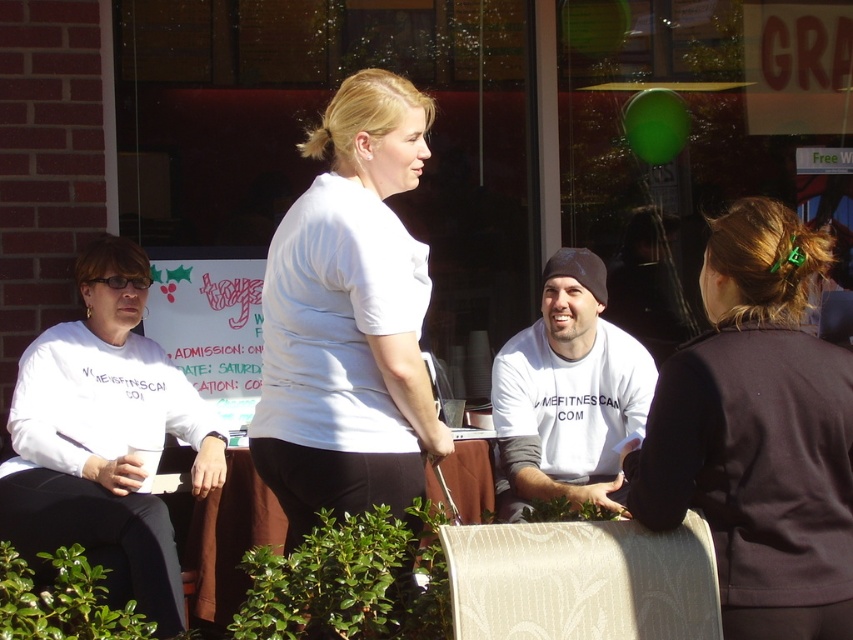
Between white matte shirt at center and white matte shirt at left, which one is positioned lower?

white matte shirt at left is below.

Based on the photo, can you confirm if white matte shirt at center is positioned above white matte shirt at left?

Indeed, white matte shirt at center is positioned over white matte shirt at left.

Is point (408, 116) farther from camera compared to point (144, 337)?

That is False.

Find the location of a particular element. white matte shirt at center is located at coordinates (349, 320).

Can you confirm if beige fabric chair at lower center is bigger than black fabric chair at lower left?

No, beige fabric chair at lower center is not bigger than black fabric chair at lower left.

This screenshot has width=853, height=640. What are the coordinates of `beige fabric chair at lower center` in the screenshot? It's located at (581, 580).

Can you confirm if dark gray fabric jacket at center is positioned to the right of beige fabric chair at lower center?

Yes, dark gray fabric jacket at center is to the right of beige fabric chair at lower center.

Which of these two, dark gray fabric jacket at center or beige fabric chair at lower center, stands taller?

dark gray fabric jacket at center is taller.

In order to click on dark gray fabric jacket at center in this screenshot , I will do pos(757,433).

Locate an element on the screen. The width and height of the screenshot is (853, 640). dark gray fabric jacket at center is located at coordinates (757, 433).